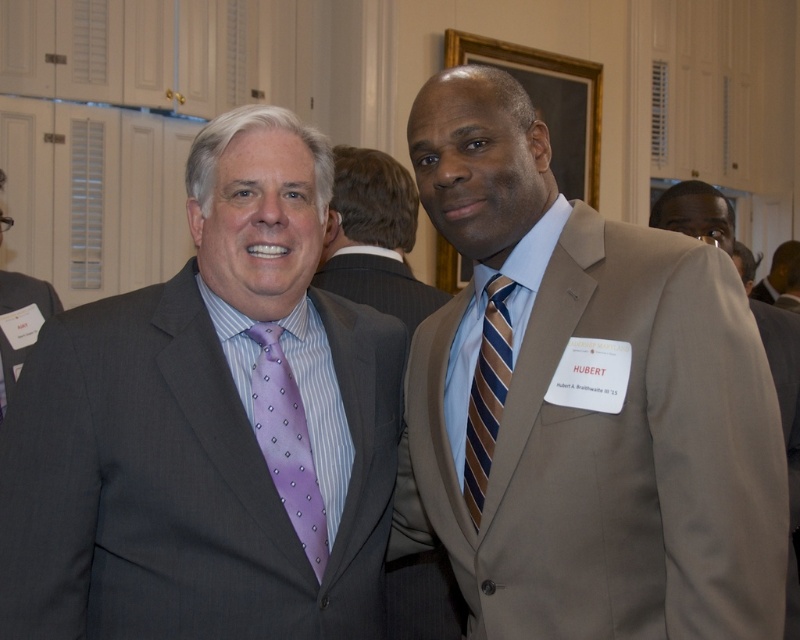
You are organizing a photo shoot and need to ensure that the matte black face at upper right and the matte black suit at left are both visible in the frame. Given their sizes, which object might require you to adjust the camera angle to capture it properly?

The matte black face at upper right is smaller than the matte black suit at left, so it might require adjusting the camera angle to ensure it is clearly visible in the frame.

You are organizing a photo shoot and need to ensure that the matte gray suit at left and the brown striped tie at center are visible in the frame. Given their sizes, which object will require you to adjust the camera angle upwards more to capture it properly?

The matte gray suit at left has a greater height compared to the brown striped tie at center, so you will need to adjust the camera angle upwards more to capture the matte gray suit at left properly.

You are a photographer standing at the camera position. You need to adjust your focus to capture a clear image of the point at coordinates point (x=32, y=436). What is the minimum distance you should set your camera focus to ensure the point is in focus?

The distance of point (x=32, y=436) from the camera is 1.35 meters, so you should set the camera focus to at least 1.35 meters to ensure the point is in focus.